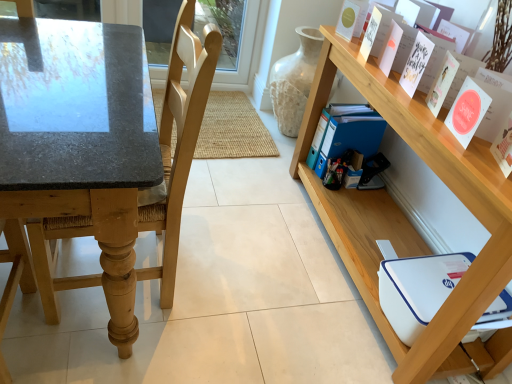
Find the location of a particular element. free space to the left of white matte paper at upper right, marked as the 6th paperback book in a back-to-front arrangement is located at coordinates (463, 151).